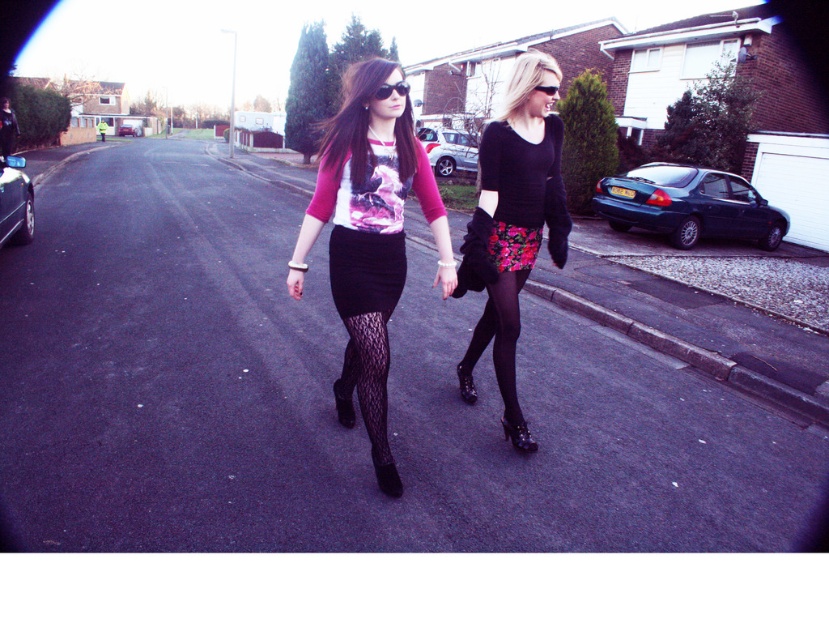
Consider the image. You are a photographer standing at the point marked by the coordinates point (343, 408). You want to capture a photo of the two women walking on the suburban street. Which direction should you face to ensure both women are in the frame?

The point (343, 408) marks the black lace boot at center. To include both women in the frame, the photographer should face towards the direction where the two women are walking, ensuring the black lace boot at center is positioned centrally while framing both subjects.

You are a delivery person who needs to place a small package between the black lace boot at center and the black plastic sunglasses at upper center. The package is 2 meters long. Will it fit between them?

The distance between the black lace boot at center and the black plastic sunglasses at upper center is 2.11 meters, so the 2 meter long package will fit between them.

You are a photographer standing at the edge of the suburban street. You want to take a photo of the black lace boot at center. Where should you position yourself to capture the boot in the frame?

To capture the black lace boot at center in the frame, position yourself so that the boot is centered at coordinates approximately 0.639 on the x axis and 0.415 on the y axis.